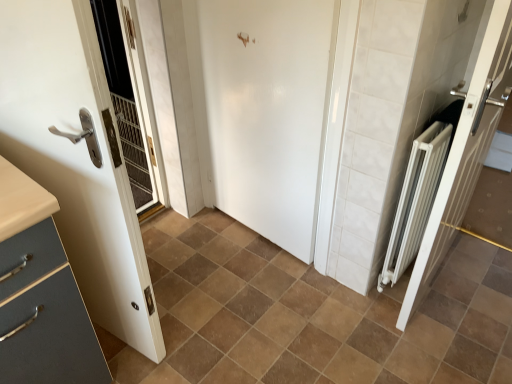
What do you see at coordinates (311, 315) in the screenshot?
I see `brown matte tile at center` at bounding box center [311, 315].

Measure the distance between point (386, 320) and camera.

Point (386, 320) is 5.92 feet from camera.

Where is `white glossy door at left, the first door from the left`? white glossy door at left, the first door from the left is located at coordinates (76, 159).

What are the coordinates of `brown matte tile at center` in the screenshot? It's located at pos(311,315).

From a real-world perspective, which is physically below, white glossy door at center, which is the second door from right to left, or white glossy door at left, the 3th door in the right-to-left sequence?

In real-world perspective, white glossy door at center, which is the second door from right to left, is lower.

In the scene shown: Which is in front, white glossy door at center, which is the second door from right to left, or white glossy door at left, the 3th door in the right-to-left sequence?

white glossy door at left, the 3th door in the right-to-left sequence, is closer to the camera.

Considering the relative sizes of white glossy door at center, which is the second door from right to left, and white glossy door at left, the 3th door in the right-to-left sequence, in the image provided, is white glossy door at center, which is the second door from right to left, thinner than white glossy door at left, the 3th door in the right-to-left sequence,?

Yes, white glossy door at center, which is the second door from right to left, is thinner than white glossy door at left, the 3th door in the right-to-left sequence.

From the image's perspective, which object appears higher, white glossy door at center, which is the second door from right to left, or white glossy door at left, the 3th door in the right-to-left sequence?

From the image's view, white glossy door at center, which is the second door from right to left, is above.

Is brown matte tile at center oriented towards white metallic radiator at right, placed as the third door when sorted from left to right?

No, brown matte tile at center is not turned towards white metallic radiator at right, placed as the third door when sorted from left to right.

Which object is closer to the camera taking this photo, brown matte tile at center or white metallic radiator at right, the 1th door positioned from the right?

white metallic radiator at right, the 1th door positioned from the right, is in front.

Which object is wider, brown matte tile at center or white metallic radiator at right, the 1th door positioned from the right?

Wider between the two is brown matte tile at center.

Which is closer, [126,382] or [454,145]?

The point [454,145] is in front.

Which object is wider, white glossy door at center, the 2th door in the left-to-right sequence, or white metallic radiator at right, the 1th door positioned from the right?

white metallic radiator at right, the 1th door positioned from the right, is wider.

From the picture: Is white glossy door at center, which is the second door from right to left, with white metallic radiator at right, placed as the third door when sorted from left to right?

There is a gap between white glossy door at center, which is the second door from right to left, and white metallic radiator at right, placed as the third door when sorted from left to right.

Considering the relative positions of white glossy door at center, which is the second door from right to left, and white metallic radiator at right, the 1th door positioned from the right, in the image provided, is white glossy door at center, which is the second door from right to left, to the left or to the right of white metallic radiator at right, the 1th door positioned from the right,?

Clearly, white glossy door at center, which is the second door from right to left, is on the left of white metallic radiator at right, the 1th door positioned from the right, in the image.

From the image's perspective, would you say white glossy door at center, which is the second door from right to left, is shown under white metallic radiator at right, the 1th door positioned from the right?

No, from the image's perspective, white glossy door at center, which is the second door from right to left, is not below white metallic radiator at right, the 1th door positioned from the right.

In the scene shown: Considering the sizes of objects white glossy door at left, the first door from the left, and white metallic radiator at right, placed as the third door when sorted from left to right, in the image provided, who is thinner, white glossy door at left, the first door from the left, or white metallic radiator at right, placed as the third door when sorted from left to right,?

Thinner between the two is white metallic radiator at right, placed as the third door when sorted from left to right.

Is white metallic radiator at right, placed as the third door when sorted from left to right, at the back of white glossy door at left, the first door from the left?

No, white metallic radiator at right, placed as the third door when sorted from left to right, is not at the back of white glossy door at left, the first door from the left.

From a real-world perspective, does white glossy door at left, the first door from the left, stand above white metallic radiator at right, placed as the third door when sorted from left to right?

Yes.

How much distance is there between white glossy door at left, the first door from the left, and white metallic radiator at right, placed as the third door when sorted from left to right?

The distance of white glossy door at left, the first door from the left, from white metallic radiator at right, placed as the third door when sorted from left to right, is 3.80 feet.

Considering the relative positions of white glossy door at left, the 3th door in the right-to-left sequence, and brown matte tile at center in the image provided, is white glossy door at left, the 3th door in the right-to-left sequence, to the left or to the right of brown matte tile at center?

Clearly, white glossy door at left, the 3th door in the right-to-left sequence, is on the left of brown matte tile at center in the image.

You are a GUI agent. You are given a task and a screenshot of the screen. Output one action in this format:
    pyautogui.click(x=<x>, y=<y>)
    Task: Click on the 1st door positioned above the brown matte tile at center (from the image's perspective)
    
    Given the screenshot: What is the action you would take?
    pyautogui.click(x=76, y=159)

Which object is thinner, white glossy door at left, the 3th door in the right-to-left sequence, or brown matte tile at center?

white glossy door at left, the 3th door in the right-to-left sequence, is thinner.

Is white glossy door at left, the 3th door in the right-to-left sequence, further to the viewer compared to brown matte tile at center?

No, white glossy door at left, the 3th door in the right-to-left sequence, is closer to the camera.

From the brown matte tile at center, count the 2nd door to the left and point to it. Please provide its 2D coordinates.

[(76, 159)]

From the image's perspective, which one is positioned lower, brown matte tile at center or white glossy door at left, the first door from the left?

brown matte tile at center.

Based on their positions, is brown matte tile at center located to the left or right of white glossy door at left, the 3th door in the right-to-left sequence?

Based on their positions, brown matte tile at center is located to the right of white glossy door at left, the 3th door in the right-to-left sequence.

Is point (273, 336) behind point (105, 287)?

Yes, it is.

Is brown matte tile at center taller than white glossy door at center, the 2th door in the left-to-right sequence?

In fact, brown matte tile at center may be shorter than white glossy door at center, the 2th door in the left-to-right sequence.

Does brown matte tile at center touch white glossy door at center, which is the second door from right to left?

No, brown matte tile at center is not with white glossy door at center, which is the second door from right to left.

Which of these two, brown matte tile at center or white glossy door at center, which is the second door from right to left, is wider?

With larger width is brown matte tile at center.

Which door is the 2nd one when counting from the front of the white glossy door at center, which is the second door from right to left? Please provide its 2D coordinates.

[(76, 159)]

Locate an element on the screen. ceramic tile behind the white metallic radiator at right, the 1th door positioned from the right is located at coordinates (311, 315).

Considering their positions, is brown matte tile at center positioned closer to white glossy door at left, the first door from the left, than white metallic radiator at right, placed as the third door when sorted from left to right?

The object closer to white glossy door at left, the first door from the left, is brown matte tile at center.

Looking at the image, which one is located further to white glossy door at left, the 3th door in the right-to-left sequence, white glossy door at center, which is the second door from right to left, or brown matte tile at center?

white glossy door at center, which is the second door from right to left.

Based on their spatial positions, is white glossy door at left, the 3th door in the right-to-left sequence, or white glossy door at center, which is the second door from right to left, further from white metallic radiator at right, the 1th door positioned from the right?

white glossy door at left, the 3th door in the right-to-left sequence, is further to white metallic radiator at right, the 1th door positioned from the right.

Based on their spatial positions, is brown matte tile at center or white glossy door at left, the 3th door in the right-to-left sequence, closer to white metallic radiator at right, the 1th door positioned from the right?

brown matte tile at center.

Considering their positions, is white glossy door at left, the 3th door in the right-to-left sequence, positioned closer to white metallic radiator at right, the 1th door positioned from the right, than brown matte tile at center?

Based on the image, brown matte tile at center appears to be nearer to white metallic radiator at right, the 1th door positioned from the right.

Based on their spatial positions, is white glossy door at center, which is the second door from right to left, or brown matte tile at center closer to white metallic radiator at right, the 1th door positioned from the right?

Based on the image, brown matte tile at center appears to be nearer to white metallic radiator at right, the 1th door positioned from the right.

In the scene shown: Based on their spatial positions, is white glossy door at left, the first door from the left, or brown matte tile at center further from white glossy door at center, which is the second door from right to left?

The object further to white glossy door at center, which is the second door from right to left, is white glossy door at left, the first door from the left.

Considering their positions, is brown matte tile at center positioned further to white metallic radiator at right, the 1th door positioned from the right, than white glossy door at center, the 2th door in the left-to-right sequence?

white glossy door at center, the 2th door in the left-to-right sequence.

The height and width of the screenshot is (384, 512). Find the location of `door between white glossy door at left, the 3th door in the right-to-left sequence, and white metallic radiator at right, placed as the third door when sorted from left to right, from left to right`. door between white glossy door at left, the 3th door in the right-to-left sequence, and white metallic radiator at right, placed as the third door when sorted from left to right, from left to right is located at coordinates (268, 111).

Where is `ceramic tile situated between white glossy door at left, the first door from the left, and white metallic radiator at right, the 1th door positioned from the right, from left to right`? This screenshot has height=384, width=512. ceramic tile situated between white glossy door at left, the first door from the left, and white metallic radiator at right, the 1th door positioned from the right, from left to right is located at coordinates (311, 315).

Image resolution: width=512 pixels, height=384 pixels. What are the coordinates of `door located between white glossy door at left, the 3th door in the right-to-left sequence, and brown matte tile at center in the left-right direction` in the screenshot? It's located at (268, 111).

The image size is (512, 384). Identify the location of ceramic tile between white glossy door at center, the 2th door in the left-to-right sequence, and white metallic radiator at right, placed as the third door when sorted from left to right. (311, 315).